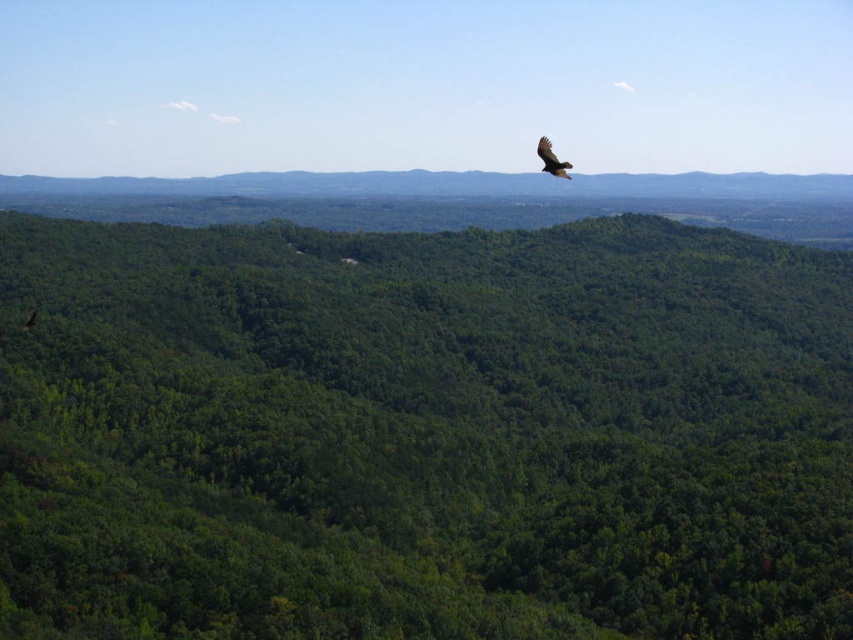
Can you confirm if green leafy forest at center is positioned to the right of dark brown feathers at upper center?

No, green leafy forest at center is not to the right of dark brown feathers at upper center.

Is point (392, 304) behind point (564, 166)?

Yes, point (392, 304) is behind point (564, 166).

The height and width of the screenshot is (640, 853). I want to click on green leafy forest at center, so click(x=422, y=433).